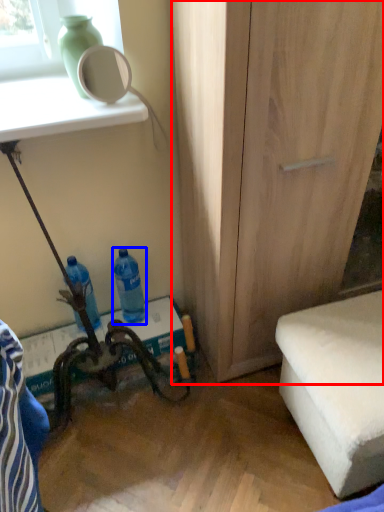
Question: Which of the following is the farthest to the observer, cabinetry (highlighted by a red box) or bottle (highlighted by a blue box)?

Choices:
 (A) cabinetry
 (B) bottle

Answer: (B)